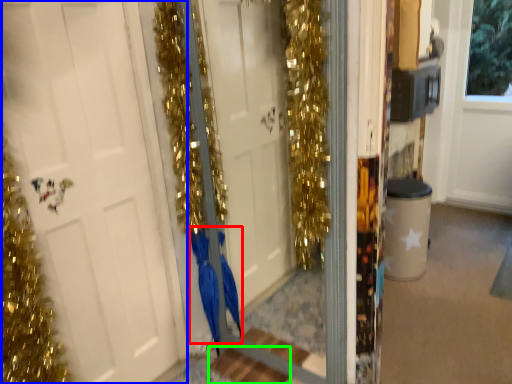
Question: Which object is positioned farthest from dress (highlighted by a red box)? Select from door (highlighted by a blue box) and stair (highlighted by a green box).

Choices:
 (A) door
 (B) stair

Answer: (A)